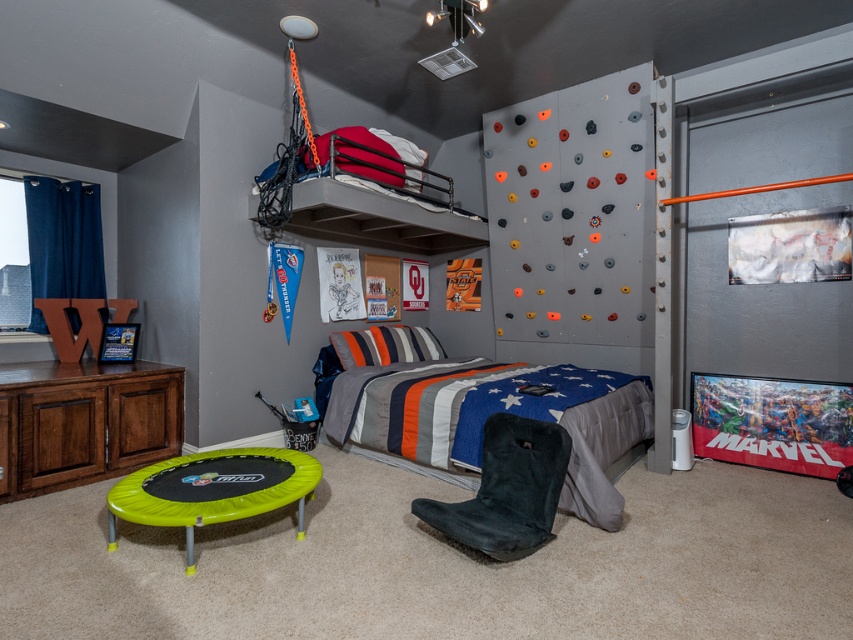
Measure the distance between striped fabric bed at center and brown wood dresser at lower left.

striped fabric bed at center and brown wood dresser at lower left are 5.32 feet apart.

Measure the distance from striped fabric bed at center to brown wood dresser at lower left.

striped fabric bed at center and brown wood dresser at lower left are 1.62 meters apart.

Does point (454, 464) lie in front of point (9, 426)?

No, (454, 464) is behind (9, 426).

Locate an element on the screen. This screenshot has height=640, width=853. striped fabric bed at center is located at coordinates (489, 413).

What do you see at coordinates (83, 420) in the screenshot?
I see `brown wood dresser at lower left` at bounding box center [83, 420].

Does brown wood dresser at lower left appear under matte black bunk bed at upper center?

Correct, brown wood dresser at lower left is located below matte black bunk bed at upper center.

This screenshot has height=640, width=853. I want to click on brown wood dresser at lower left, so 83,420.

Is striped fabric bed at center positioned in front of matte black bunk bed at upper center?

Yes, it is in front of matte black bunk bed at upper center.

Can you confirm if striped fabric bed at center is taller than matte black bunk bed at upper center?

Indeed, striped fabric bed at center has a greater height compared to matte black bunk bed at upper center.

Which is in front, point (469, 365) or point (338, 195)?

Point (338, 195) is in front.

Image resolution: width=853 pixels, height=640 pixels. Identify the location of striped fabric bed at center. (489, 413).